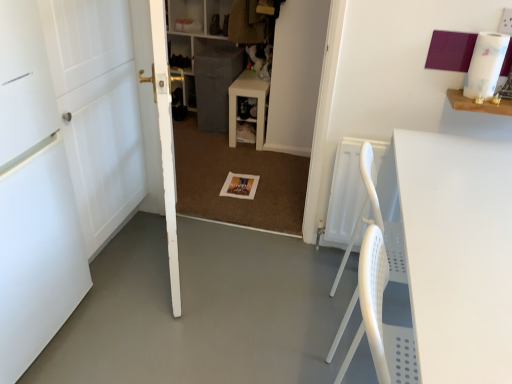
Question: Would you say gray fabric cabinet at center is a long distance from matte white table at center, which is counted as the 1th table, starting from the back?

Choices:
 (A) no
 (B) yes

Answer: (A)

Question: From a real-world perspective, is gray fabric cabinet at center under matte white table at center, the 2th table in the right-to-left sequence?

Choices:
 (A) no
 (B) yes

Answer: (A)

Question: From the image's perspective, is gray fabric cabinet at center over matte white table at center, which is counted as the 2th table, starting from the front?

Choices:
 (A) yes
 (B) no

Answer: (A)

Question: Could matte white table at center, which is counted as the 1th table, starting from the back, be considered to be inside gray fabric cabinet at center?

Choices:
 (A) yes
 (B) no

Answer: (B)

Question: Could you tell me if gray fabric cabinet at center is facing matte white table at center, positioned as the 2th table in bottom-to-top order?

Choices:
 (A) yes
 (B) no

Answer: (B)

Question: From the image's perspective, is matte white table at center, positioned as the first table in top-to-bottom order, positioned above or below gray fabric cabinet at center?

Choices:
 (A) above
 (B) below

Answer: (B)

Question: Is matte white table at center, which is counted as the 2th table, starting from the front, spatially inside gray fabric cabinet at center, or outside of it?

Choices:
 (A) inside
 (B) outside

Answer: (B)

Question: Considering the positions of matte white table at center, the 2th table in the right-to-left sequence, and gray fabric cabinet at center in the image, is matte white table at center, the 2th table in the right-to-left sequence, wider or thinner than gray fabric cabinet at center?

Choices:
 (A) wide
 (B) thin

Answer: (B)

Question: Is matte white table at center, positioned as the 2th table in bottom-to-top order, bigger or smaller than gray fabric cabinet at center?

Choices:
 (A) small
 (B) big

Answer: (A)

Question: Is matte white table at center, which is counted as the 2th table, starting from the front, in front of or behind white wooden door at left, the 3th door when ordered from left to right, in the image?

Choices:
 (A) behind
 (B) front

Answer: (A)

Question: Based on their positions, is matte white table at center, the 2th table in the right-to-left sequence, located to the left or right of white wooden door at left, which is counted as the 1th door, starting from the right?

Choices:
 (A) left
 (B) right

Answer: (B)

Question: From a real-world perspective, is matte white table at center, positioned as the first table in top-to-bottom order, positioned above or below white wooden door at left, the 3th door when ordered from left to right?

Choices:
 (A) above
 (B) below

Answer: (B)

Question: Considering the positions of matte white table at center, arranged as the first table when viewed from the left, and white wooden door at left, which is counted as the 1th door, starting from the right, in the image, is matte white table at center, arranged as the first table when viewed from the left, wider or thinner than white wooden door at left, which is counted as the 1th door, starting from the right,?

Choices:
 (A) thin
 (B) wide

Answer: (B)

Question: From a real-world perspective, is matte white table at center, which is counted as the 1th table, starting from the back, positioned above or below gray fabric bookshelf at center?

Choices:
 (A) below
 (B) above

Answer: (A)

Question: In terms of height, does matte white table at center, positioned as the 2th table in bottom-to-top order, look taller or shorter compared to gray fabric bookshelf at center?

Choices:
 (A) short
 (B) tall

Answer: (A)